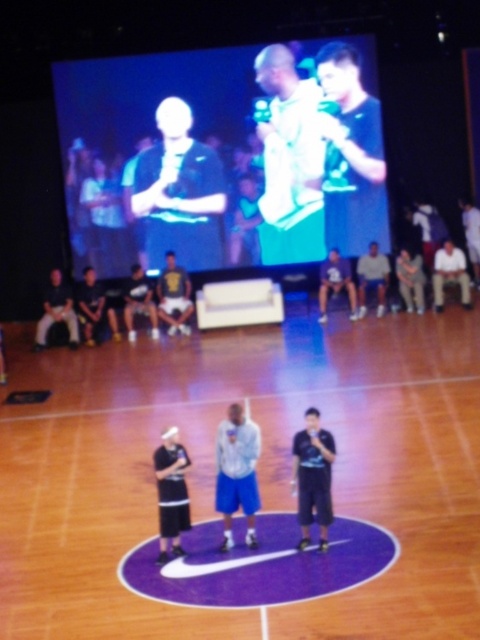
Does white matte jersey at center have a smaller size compared to dark gray fabric cap at center?

Actually, white matte jersey at center might be larger than dark gray fabric cap at center.

Who is more forward, [282,195] or [184,451]?

Point [184,451]

Who is more forward, (265, 84) or (178, 548)?

Point (178, 548) is more forward.

The image size is (480, 640). Identify the location of white matte jersey at center. (289, 161).

Is matte black shirt at center below dark blue shirt at center?

No, matte black shirt at center is not below dark blue shirt at center.

Does point (189, 262) come behind point (324, 472)?

Yes, it is.

This screenshot has width=480, height=640. Describe the element at coordinates (180, 193) in the screenshot. I see `matte black shirt at center` at that location.

You are a GUI agent. You are given a task and a screenshot of the screen. Output one action in this format:
    pyautogui.click(x=<x>, y=<y>)
    Task: Click on the matte black shirt at center
    The height and width of the screenshot is (640, 480).
    Given the screenshot: What is the action you would take?
    pyautogui.click(x=180, y=193)

Is light blue fabric shorts at center further to the viewer compared to dark gray fabric cap at center?

Yes.

How distant is light blue fabric shorts at center from dark gray fabric cap at center?

light blue fabric shorts at center is 24.52 inches away from dark gray fabric cap at center.

The image size is (480, 640). What do you see at coordinates (237, 472) in the screenshot?
I see `light blue fabric shorts at center` at bounding box center [237, 472].

This screenshot has height=640, width=480. In order to click on light blue fabric shorts at center in this screenshot , I will do pyautogui.click(x=237, y=472).